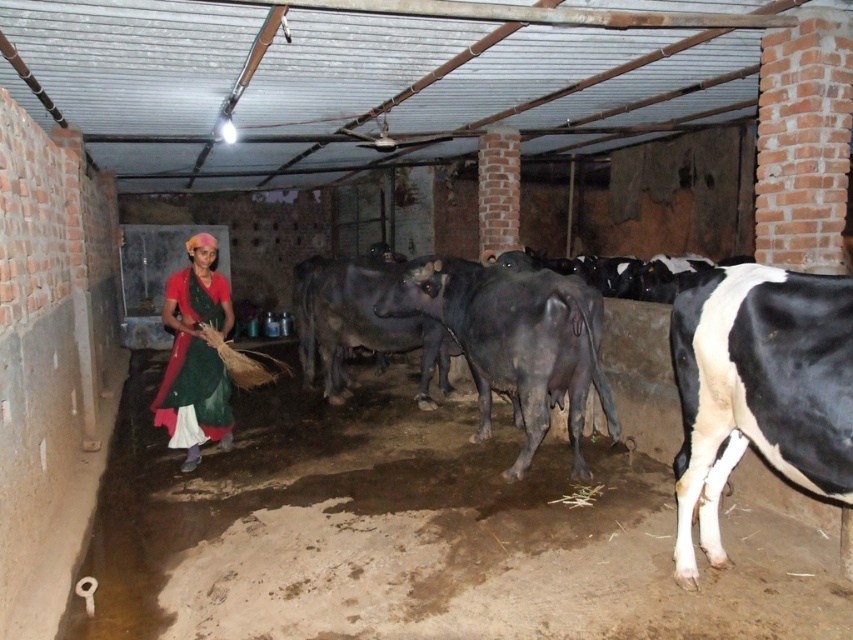
You are a farmer standing in the barn and see the shiny black cow at center and the matte red dress at center. Which object takes up more space in the image?

The shiny black cow at center is bigger than the matte red dress at center, so it takes up more space in the image.